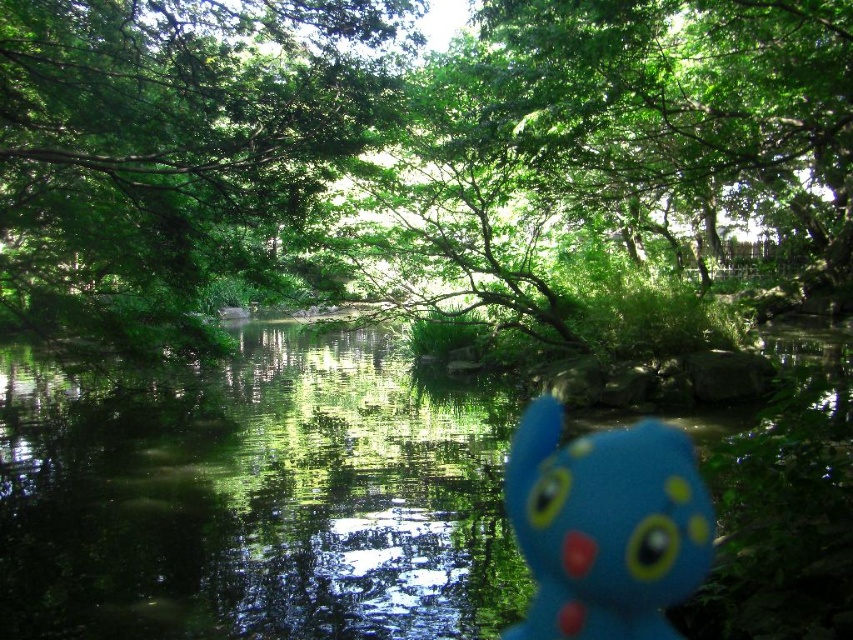
Question: Which object is positioned farthest from the green leafy tree at upper center?

Choices:
 (A) blue rubber toy at center
 (B) green reflective water at center

Answer: (A)

Question: Which point is closer to the camera?

Choices:
 (A) (553, 557)
 (B) (514, 177)
 (C) (33, 220)

Answer: (A)

Question: Which is nearer to the green leafy tree at center?

Choices:
 (A) green leafy tree at upper center
 (B) blue rubber toy at center

Answer: (B)

Question: Does green leafy tree at center lie in front of green reflective water at center?

Choices:
 (A) yes
 (B) no

Answer: (B)

Question: Observing the image, what is the correct spatial positioning of green leafy tree at upper center in reference to blue rubber toy at center?

Choices:
 (A) above
 (B) below

Answer: (A)

Question: Can you confirm if green reflective water at center is positioned to the right of green leafy tree at upper center?

Choices:
 (A) yes
 (B) no

Answer: (A)